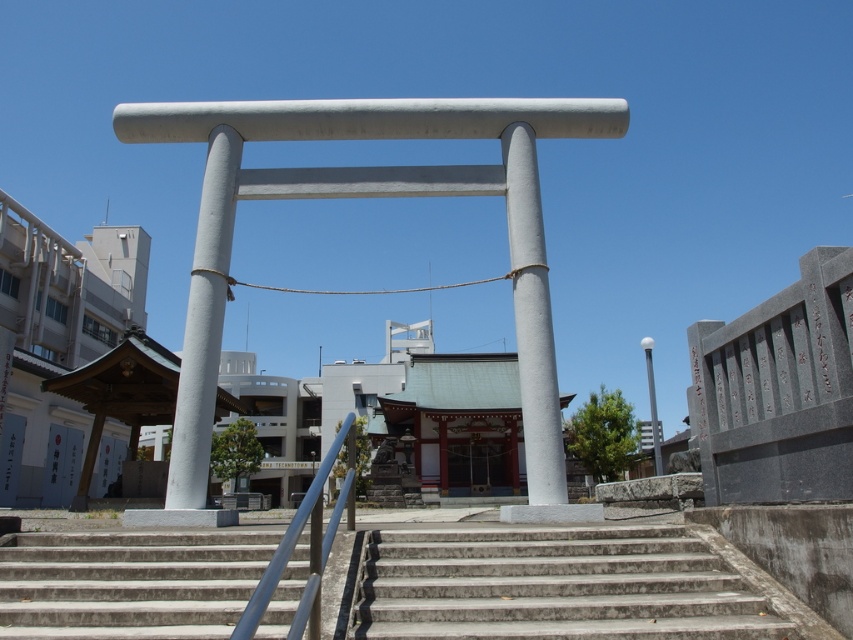
You are a tourist standing at the bottom of the gray concrete stairs at center. You want to walk up to the torii gate. Which direction should you go to reach the torii gate?

The gray concrete stairs at center lead directly to the torii gate, so you should go forward towards the gray concrete stairs at center to reach the torii gate.

You are standing at the base of the torii gate and want to find the concrete stairs at center. According to the image, where should you look in terms of direction?

The concrete stairs at center are located at the base of the torii gate, so you should look straight ahead in the center direction to find them.